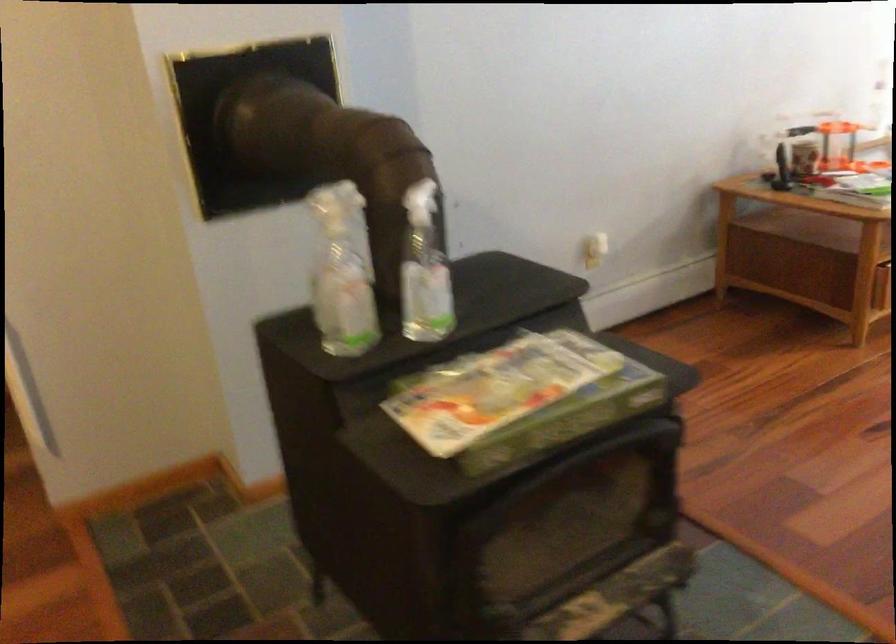
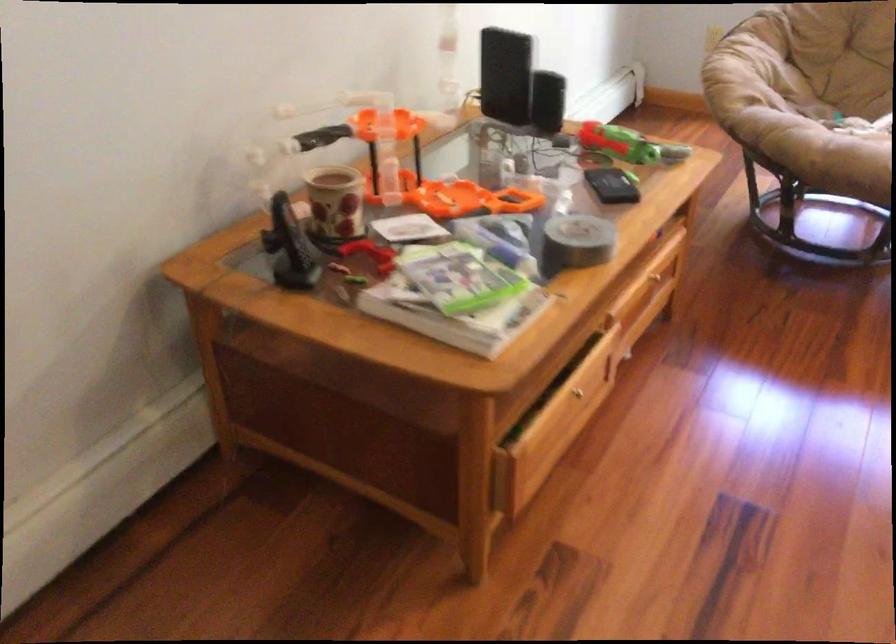
In a continuous first-person perspective shot, in which direction is the camera moving?

The movement direction of the cameraman is right, forward.